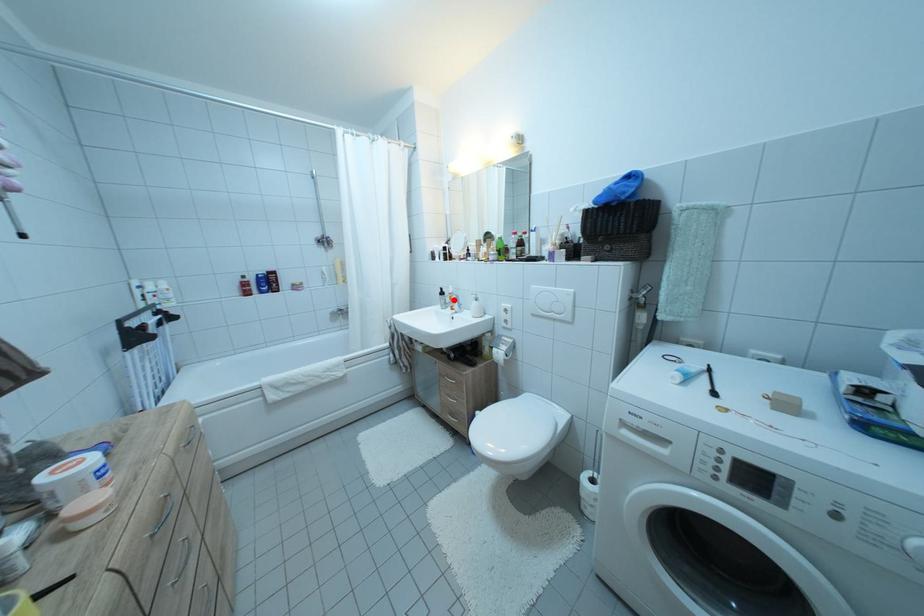
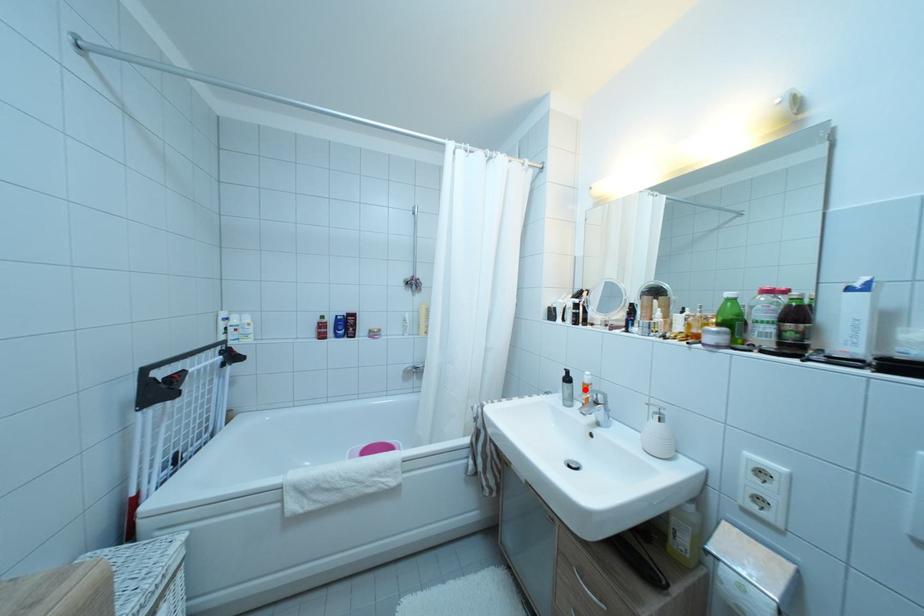
I am providing you with two images of the same scene from different viewpoints. A red point is marked on the first image and another point is marked on the second image. Does the point marked in image1 correspond to the same location as the one in image2?

Yes